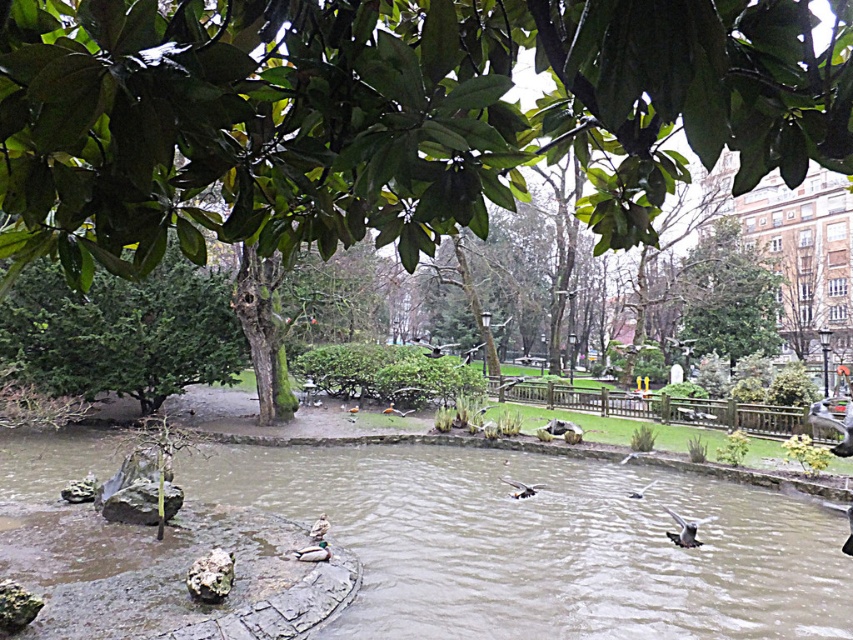
Is point (682, 289) more distant than point (328, 560)?

Yes, it is behind point (328, 560).

Is point (737, 292) less distant than point (321, 554)?

No, it is behind (321, 554).

Locate an element on the screen. This screenshot has width=853, height=640. green textured tree at upper center is located at coordinates (727, 296).

Does gray feathered bird at center appear on the left side of brown matte duck at center?

Incorrect, gray feathered bird at center is not on the left side of brown matte duck at center.

Does gray feathered bird at center come in front of brown matte duck at center?

No, it is behind brown matte duck at center.

Is point (695, 528) positioned behind point (320, 529)?

Yes, point (695, 528) is behind point (320, 529).

The height and width of the screenshot is (640, 853). Find the location of `gray feathered bird at center`. gray feathered bird at center is located at coordinates click(683, 531).

Can you confirm if brown stone river at center is taller than brown matte duck at center?

Yes.

Which of these two, brown stone river at center or brown matte duck at center, stands shorter?

Standing shorter between the two is brown matte duck at center.

The image size is (853, 640). Describe the element at coordinates (544, 544) in the screenshot. I see `brown stone river at center` at that location.

Where is `brown stone river at center`? The width and height of the screenshot is (853, 640). brown stone river at center is located at coordinates (544, 544).